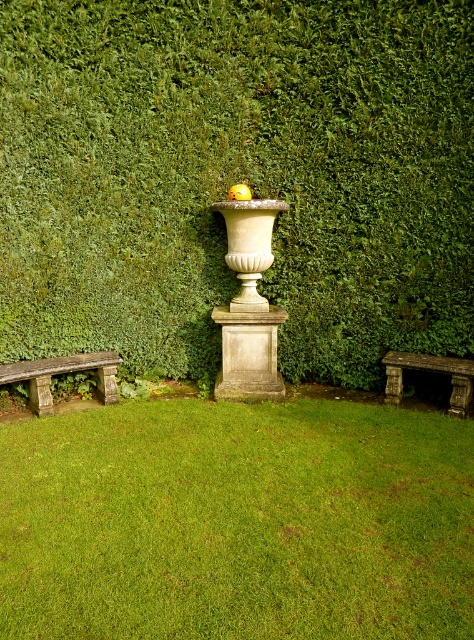
Is point (7, 429) behind point (422, 355)?

No, (7, 429) is closer to viewer.

Does green grass at center appear under rusty stone bench at lower right?

Correct, green grass at center is located below rusty stone bench at lower right.

Measure the distance between green grass at center and camera.

A distance of 7.84 feet exists between green grass at center and camera.

Locate an element on the screen. The width and height of the screenshot is (474, 640). green grass at center is located at coordinates (237, 522).

Is point (435, 179) more distant than point (28, 387)?

No, it is not.

Does green leafy hedge at center lie in front of stone bench at lower left?

Yes, it is.

Image resolution: width=474 pixels, height=640 pixels. I want to click on green leafy hedge at center, so click(x=237, y=177).

You are a GUI agent. You are given a task and a screenshot of the screen. Output one action in this format:
    pyautogui.click(x=<x>, y=<y>)
    Task: Click on the green leafy hedge at center
    The height and width of the screenshot is (640, 474).
    Given the screenshot: What is the action you would take?
    pyautogui.click(x=237, y=177)

Can you confirm if green leafy hedge at center is positioned below green grass at center?

No, green leafy hedge at center is not below green grass at center.

Is green leafy hedge at center smaller than green grass at center?

Incorrect, green leafy hedge at center is not smaller in size than green grass at center.

Measure the distance between point (112, 132) and camera.

A distance of 5.09 meters exists between point (112, 132) and camera.

Identify the location of green leafy hedge at center. The height and width of the screenshot is (640, 474). (237, 177).